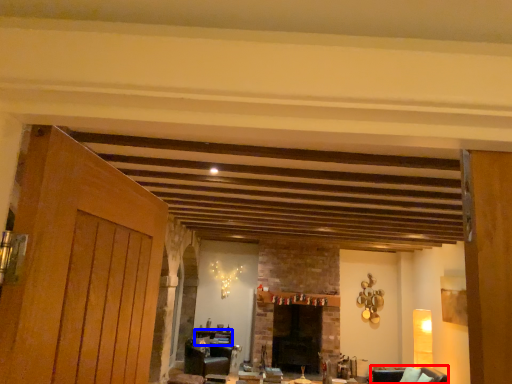
Question: Among these objects, which one is farthest to the camera, armchair (highlighted by a red box) or table (highlighted by a blue box)?

Choices:
 (A) armchair
 (B) table

Answer: (B)